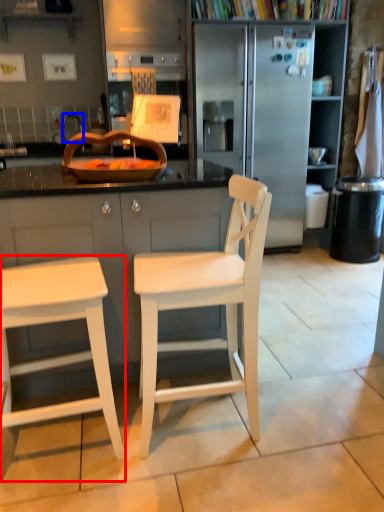
Question: Which of the following is the farthest to the observer, stool (highlighted by a red box) or faucet (highlighted by a blue box)?

Choices:
 (A) stool
 (B) faucet

Answer: (B)